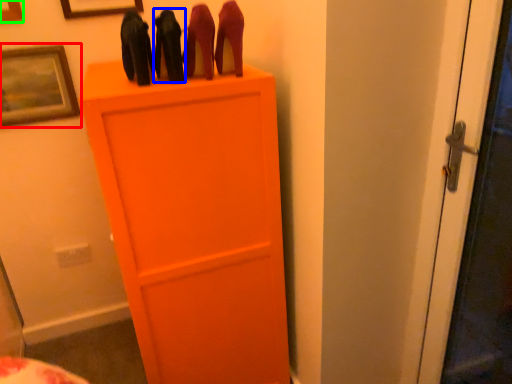
Question: Which is nearer to the picture frame (highlighted by a red box)? stuff (highlighted by a blue box) or picture frame (highlighted by a green box).

Choices:
 (A) stuff
 (B) picture frame

Answer: (B)